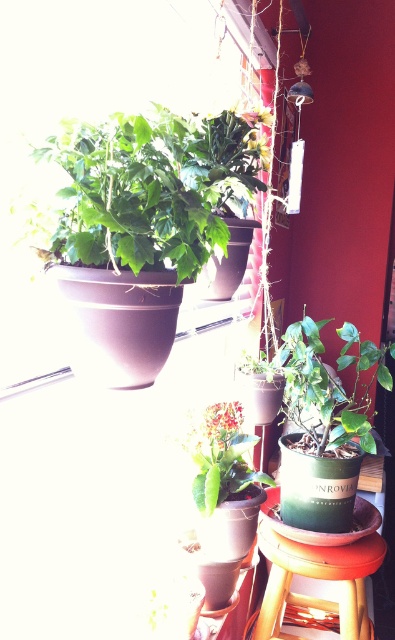
Question: Does wooden stool at lower center have a lesser width compared to green matte plant at center?

Choices:
 (A) no
 (B) yes

Answer: (A)

Question: Is matte brown pot at upper left positioned in front of green matte plant at center?

Choices:
 (A) yes
 (B) no

Answer: (A)

Question: Among these objects, which one is nearest to the camera?

Choices:
 (A) wooden stool at lower center
 (B) matte brown pot at upper left
 (C) green matte plant at center

Answer: (B)

Question: Which of the following is the closest to the observer?

Choices:
 (A) matte brown pot at upper left
 (B) green matte plant at lower right
 (C) wooden stool at lower center

Answer: (A)

Question: Does matte brown pot at upper left appear under green matte plant at center?

Choices:
 (A) no
 (B) yes

Answer: (A)

Question: Which object appears closest to the camera in this image?

Choices:
 (A) green matte plant at lower right
 (B) green matte plant at center

Answer: (B)